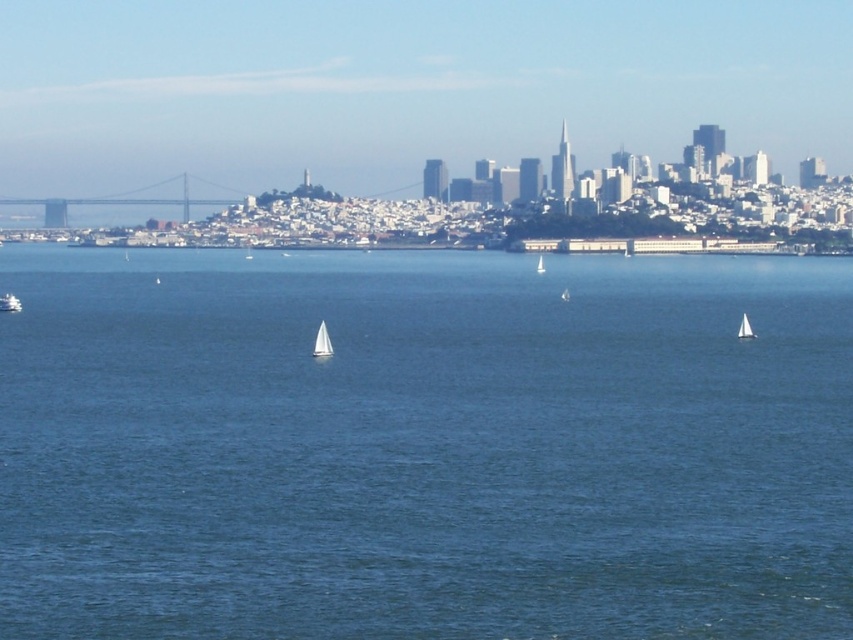
Between metallic gray bridge at left and white matte sailboat at lower left, which one is positioned lower?

white matte sailboat at lower left is lower down.

Between metallic gray bridge at left and white matte sailboat at lower left, which one has less height?

Standing shorter between the two is white matte sailboat at lower left.

You are a GUI agent. You are given a task and a screenshot of the screen. Output one action in this format:
    pyautogui.click(x=<x>, y=<y>)
    Task: Click on the metallic gray bridge at left
    
    Given the screenshot: What is the action you would take?
    pyautogui.click(x=109, y=204)

Is white sailboat at center shorter than white matte sailboat at lower left?

Incorrect, white sailboat at center's height does not fall short of white matte sailboat at lower left's.

Between point (328, 333) and point (15, 300), which one is positioned in front?

Positioned in front is point (328, 333).

In order to click on white sailboat at center in this screenshot , I will do pos(322,342).

Between metallic gray bridge at left and white sailboat at right, which one is positioned higher?

metallic gray bridge at left

Is metallic gray bridge at left taller than white sailboat at right?

Yes, metallic gray bridge at left is taller than white sailboat at right.

The image size is (853, 640). Describe the element at coordinates (109, 204) in the screenshot. I see `metallic gray bridge at left` at that location.

You are a GUI agent. You are given a task and a screenshot of the screen. Output one action in this format:
    pyautogui.click(x=<x>, y=<y>)
    Task: Click on the metallic gray bridge at left
    The image size is (853, 640).
    Given the screenshot: What is the action you would take?
    pyautogui.click(x=109, y=204)